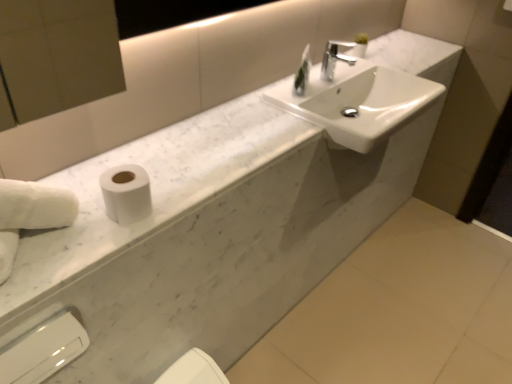
The image size is (512, 384). What are the coordinates of `vacant area that is in front of white matte toilet paper at left` in the screenshot? It's located at point(88,249).